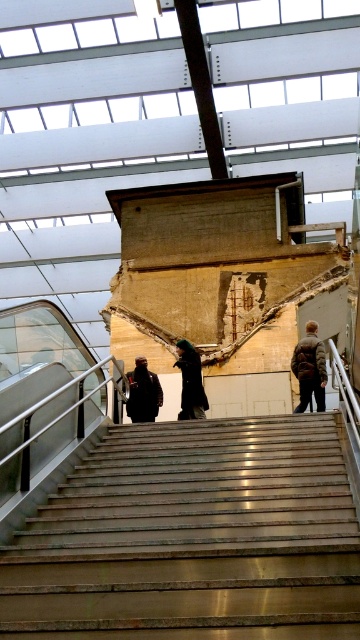
You are standing at the bottom of the staircase and see both the black matte coat at center and the dark gray jacket at center hanging on the same rack. Which item is closer to you?

The black matte coat at center is closer to you because it is further to the viewer than the dark gray jacket at center.

You are carrying a heavy box and need to reach the upper floor. You see the polished marble stairs at center and the brown fuzzy coat at upper right. Which object is closer to the upper floor?

The brown fuzzy coat at upper right is closer to the upper floor because it is located above the polished marble stairs at center.